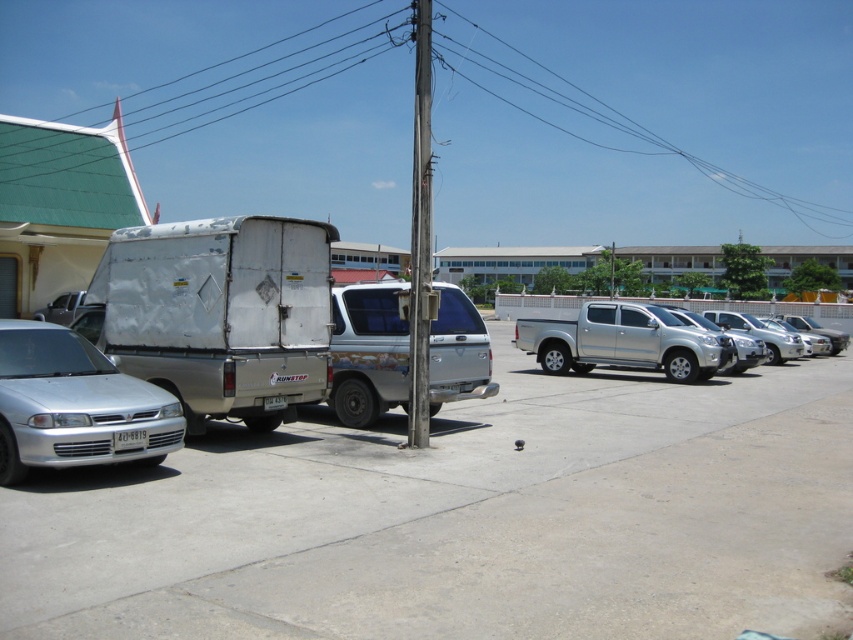
You are standing at the entrance of the parking lot and want to take a photo of both the silver metallic sedan at left and the silver metallic van at center. Which vehicle should you position yourself closer to in order to capture both in a single frame?

You should position yourself closer to the silver metallic sedan at left because it is closer to the viewer than the silver metallic van at center, allowing both to be in the same frame without zooming out too much.

You are a delivery person trying to park your van in the parking area. You see the silver metallic pickup truck at center and the weathered wood pole at center. Which object is closer to the ground?

The silver metallic pickup truck at center is below the weathered wood pole at center, so it is closer to the ground.

You are standing in the parking area and want to walk from point A to point B. Point A is located at coordinates point (x=608, y=353) and point B is at coordinates point (x=419, y=129). Since you can only move forward, will you be moving towards or away from the utility pole as you go from point A to point B?

Since point (x=608, y=353) is further to the viewer than point (x=419, y=129), moving from point A to point B means you are moving away from the utility pole.